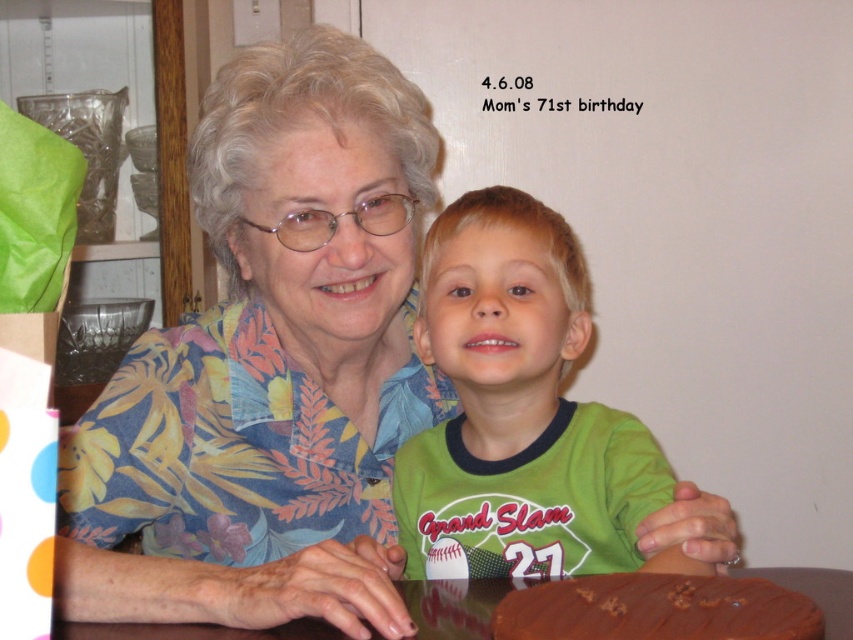
Looking at this image, who is taller, green jersey at center or brown glossy table at lower center?

With more height is green jersey at center.

Locate an element on the screen. This screenshot has width=853, height=640. green jersey at center is located at coordinates (515, 410).

Where is `green jersey at center`? This screenshot has width=853, height=640. green jersey at center is located at coordinates (515, 410).

Is green jersey at center positioned before chocolate matte cake at lower center?

That is False.

Does green jersey at center have a smaller size compared to chocolate matte cake at lower center?

No.

Which is behind, point (514, 282) or point (575, 636)?

Point (514, 282)

At what (x,y) coordinates should I click in order to perform the action: click on green jersey at center. Please return your answer as a coordinate pair (x, y). Image resolution: width=853 pixels, height=640 pixels. Looking at the image, I should click on (515, 410).

Between point (583, 621) and point (805, 570), which one is positioned behind?

The point (805, 570) is more distant.

Does chocolate matte cake at lower center have a smaller size compared to brown glossy table at lower center?

Correct, chocolate matte cake at lower center occupies less space than brown glossy table at lower center.

Is point (746, 616) farther from camera compared to point (78, 625)?

No, it is not.

I want to click on chocolate matte cake at lower center, so (656, 609).